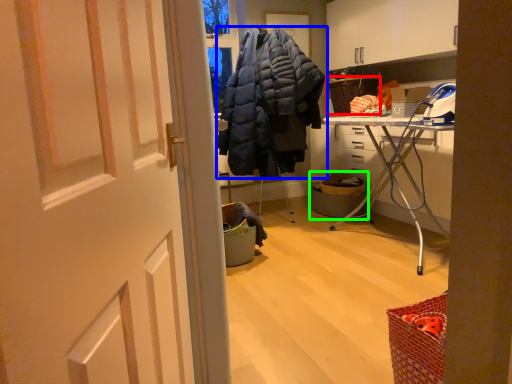
Question: Which object is positioned closest to picnic basket (highlighted by a red box)? Select from jacket (highlighted by a blue box) and laundry basket (highlighted by a green box).

Choices:
 (A) jacket
 (B) laundry basket

Answer: (B)